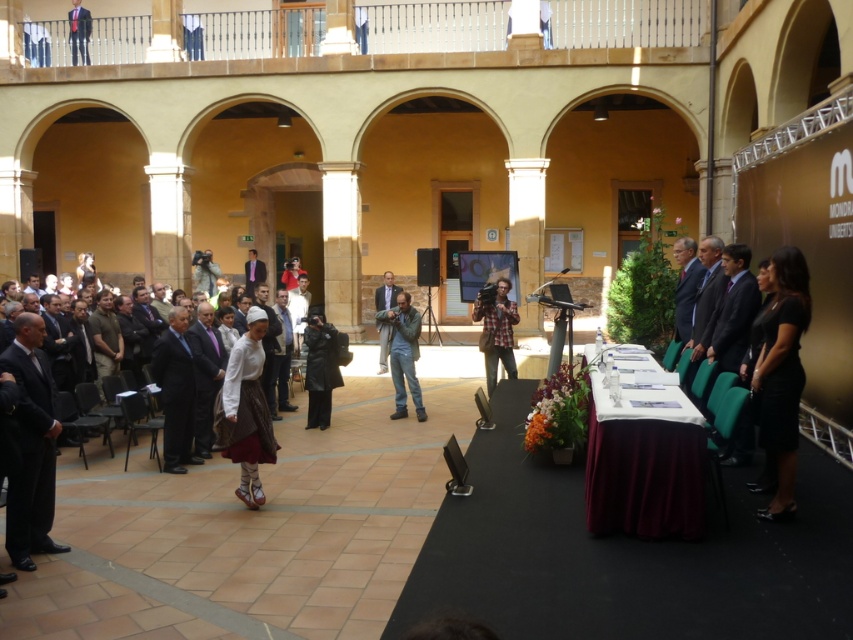
Which is behind, point (263, 396) or point (79, 4)?

Positioned behind is point (79, 4).

Which is in front, point (215, 419) or point (79, 4)?

Point (215, 419) is in front.

Where is `white cotton blouse at center`? The image size is (853, 640). white cotton blouse at center is located at coordinates (245, 412).

Is white cotton blouse at center below leather jacket at center?

Actually, white cotton blouse at center is above leather jacket at center.

Which is more to the left, white cotton blouse at center or leather jacket at center?

white cotton blouse at center

Find the location of a particular element. Image resolution: width=853 pixels, height=640 pixels. white cotton blouse at center is located at coordinates (245, 412).

What are the coordinates of `white cotton blouse at center` in the screenshot? It's located at (245, 412).

Does denim jeans at center appear over matte black suit at upper center?

Actually, denim jeans at center is below matte black suit at upper center.

Where is `denim jeans at center`? This screenshot has height=640, width=853. denim jeans at center is located at coordinates (403, 353).